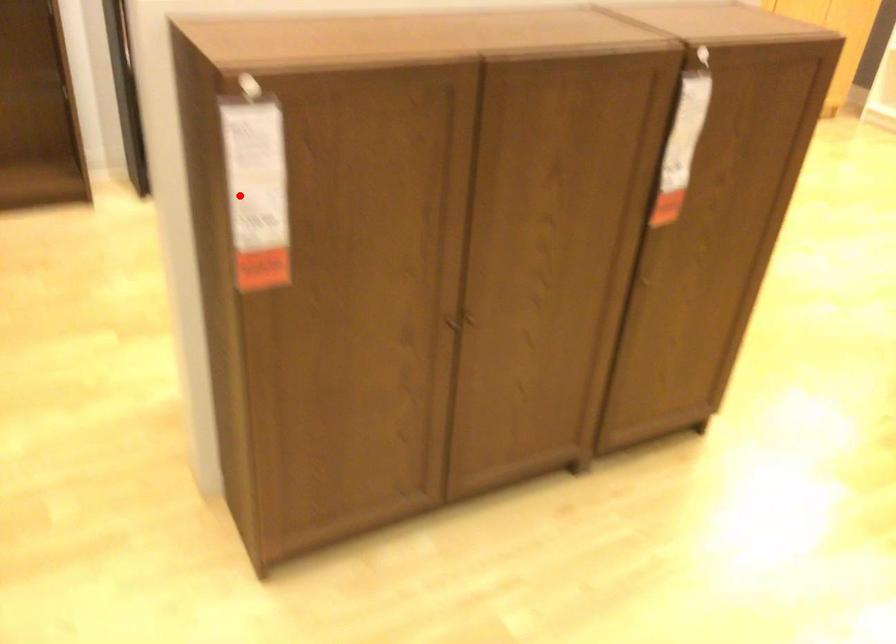
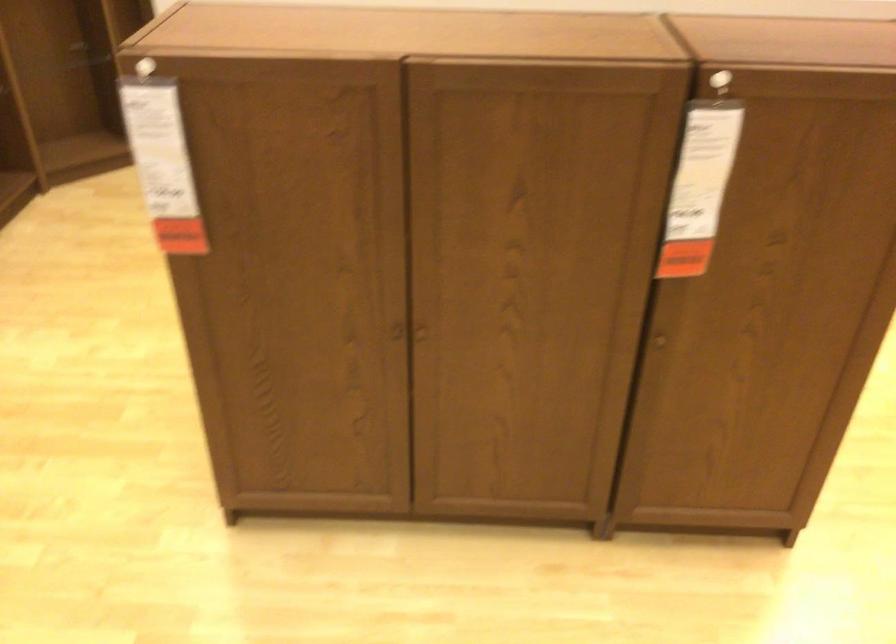
Locate, in the second image, the point that corresponds to the highlighted location in the first image.

(162, 164)